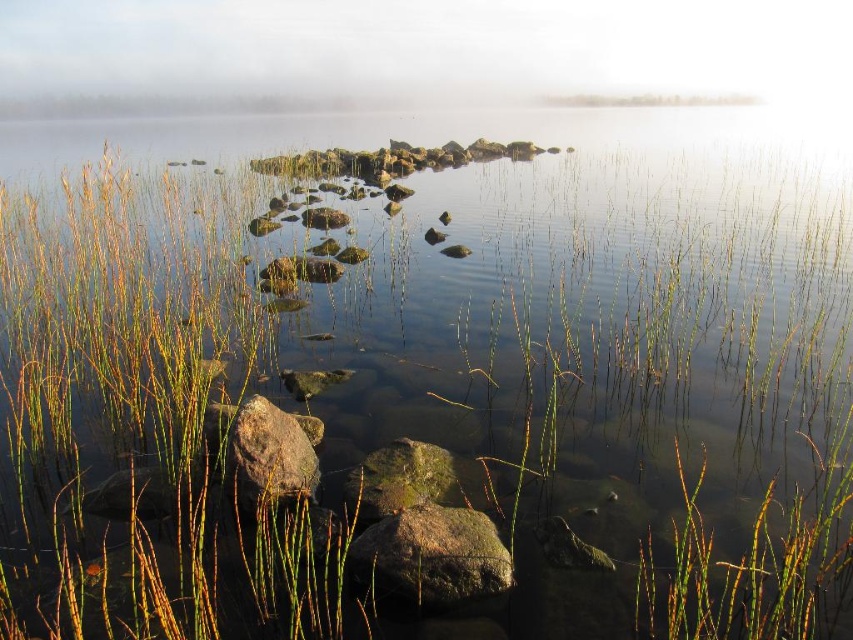
Question: In this image, where is green grass at center located relative to green mossy rock at center?

Choices:
 (A) above
 (B) below

Answer: (A)

Question: Is white mist at upper center bigger than green mossy rock at lower center?

Choices:
 (A) yes
 (B) no

Answer: (A)

Question: Which point appears farthest from the camera in this image?

Choices:
 (A) (229, 436)
 (B) (221, 534)
 (C) (364, 472)
 (D) (64, 93)

Answer: (D)

Question: Among these objects, which one is nearest to the camera?

Choices:
 (A) rusty metallic boulder at lower left
 (B) green grass at center
 (C) white mist at upper center
 (D) green mossy rock at center

Answer: (B)

Question: Which point is farther to the camera?

Choices:
 (A) (225, 472)
 (B) (490, 577)
 (C) (721, 17)
 (D) (143, 499)

Answer: (C)

Question: Considering the relative positions of green grass at center and rusty metallic boulder at lower left in the image provided, where is green grass at center located with respect to rusty metallic boulder at lower left?

Choices:
 (A) below
 (B) above

Answer: (B)